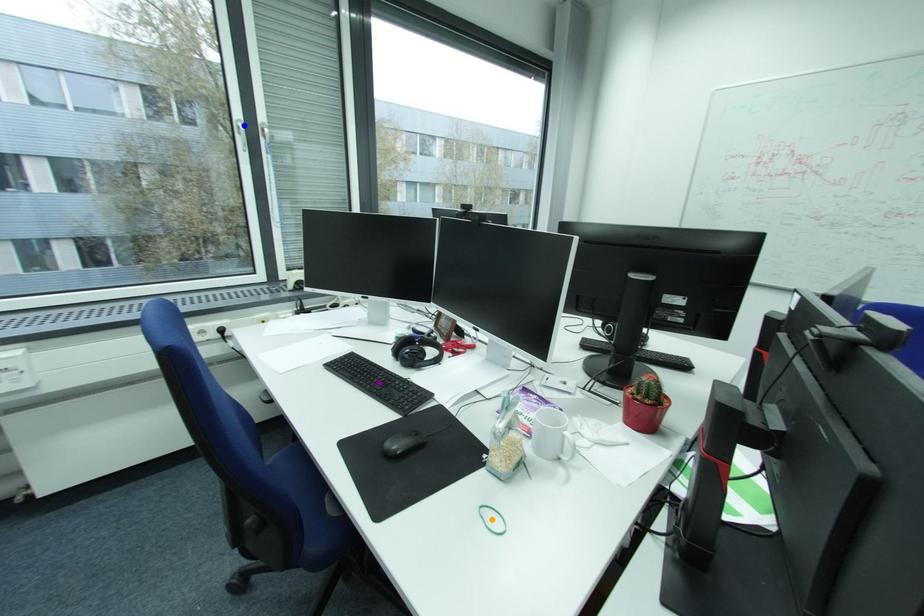
In the scene shown: Order these from nearest to farthest:
orange point | blue point | purple point

blue point, purple point, orange point